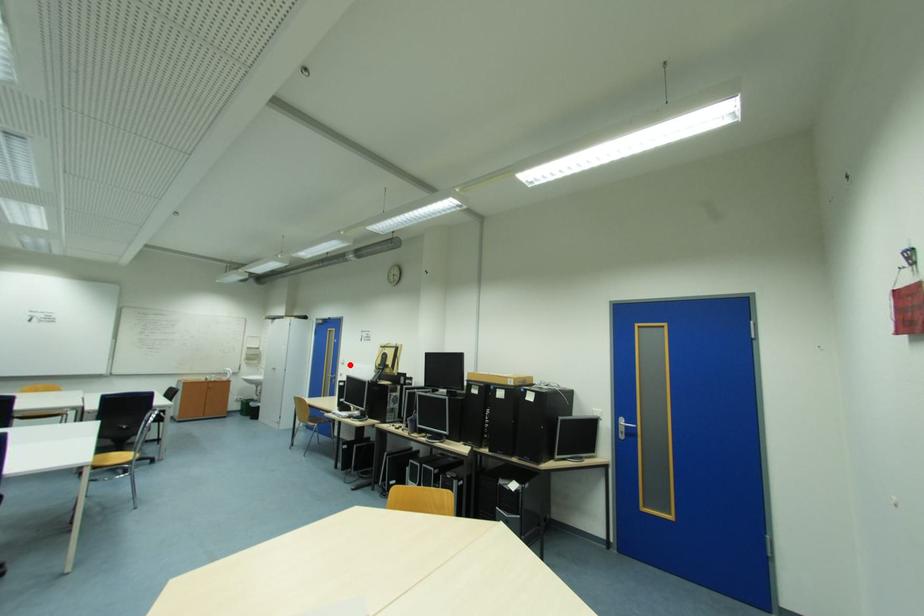
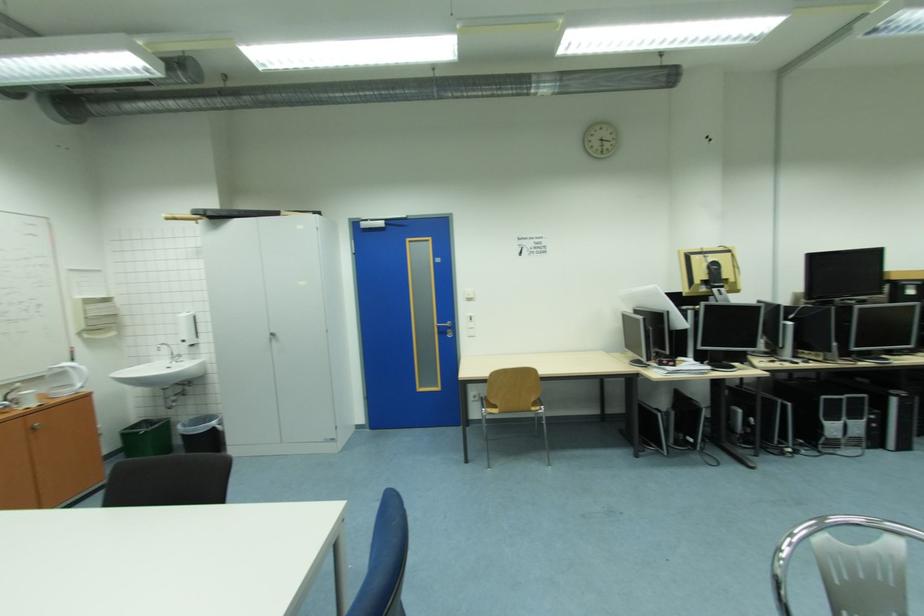
Question: A red point is marked in image1. In image2, is the corresponding 3D point closer to the camera or farther? Reply with the corresponding letter.

Choices:
 (A) The corresponding 3D point is closer.
 (B) The corresponding 3D point is farther.

Answer: (A)